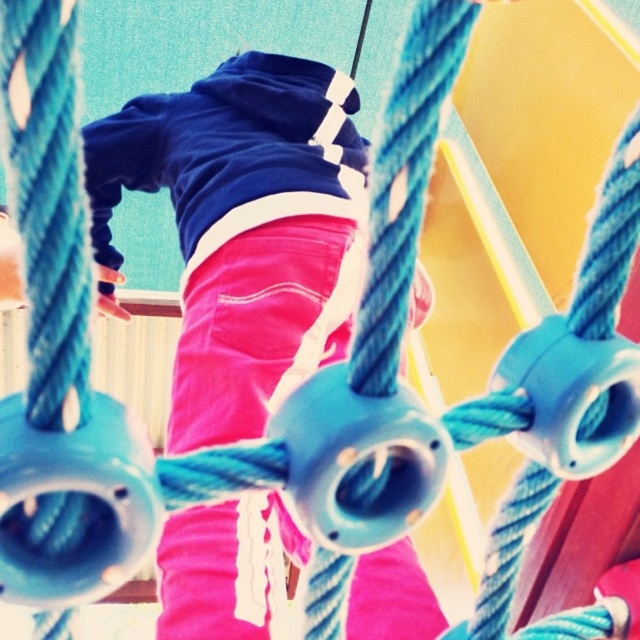
Who is higher up, pink corduroy pants at center or velvet blue sweatshirt at upper center?

velvet blue sweatshirt at upper center is above.

Between point (250, 586) and point (209, 248), which one is positioned behind?

Positioned behind is point (209, 248).

Locate an element on the screen. This screenshot has width=640, height=640. pink corduroy pants at center is located at coordinates (243, 228).